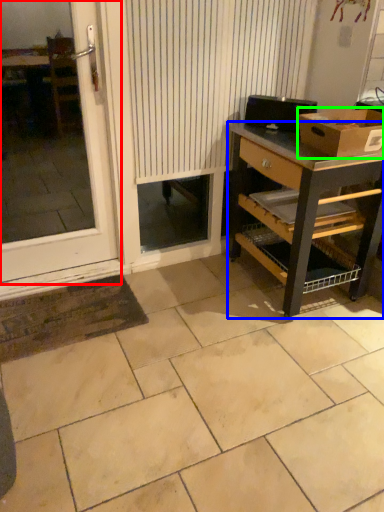
Question: Which object is the closest to the window (highlighted by a red box)? Choose among these: desk (highlighted by a blue box) or box (highlighted by a green box).

Choices:
 (A) desk
 (B) box

Answer: (A)